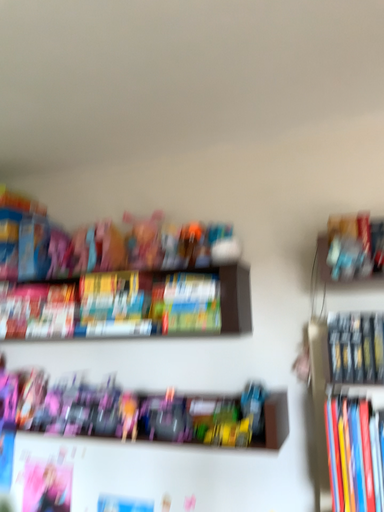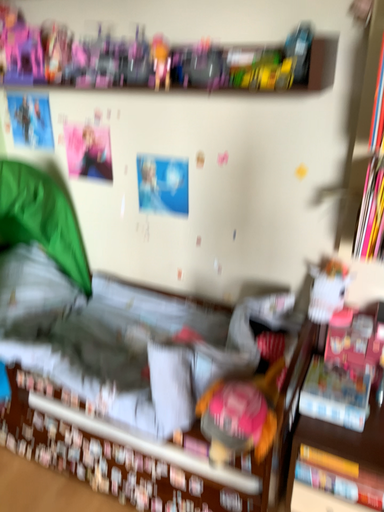
Question: How did the camera likely rotate when shooting the video?

Choices:
 (A) rotated upward
 (B) rotated downward

Answer: (B)